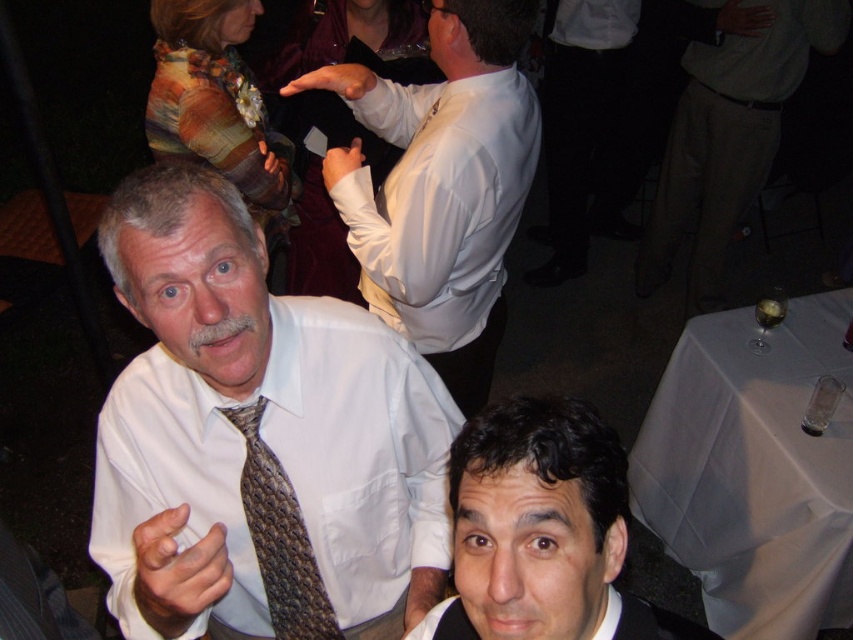
Between white satin shirt at upper center and textured brown tie at center, which one is positioned lower?

textured brown tie at center is below.

Between white satin shirt at upper center and textured brown tie at center, which one appears on the right side from the viewer's perspective?

Positioned to the right is white satin shirt at upper center.

Does point (404, 236) come farther from viewer compared to point (283, 512)?

Yes.

You are a GUI agent. You are given a task and a screenshot of the screen. Output one action in this format:
    pyautogui.click(x=<x>, y=<y>)
    Task: Click on the white satin shirt at upper center
    This screenshot has height=640, width=853.
    Given the screenshot: What is the action you would take?
    pyautogui.click(x=440, y=202)

Is point (167, 406) positioned in front of point (260, 492)?

Yes, it is in front of point (260, 492).

The width and height of the screenshot is (853, 640). Find the location of `white textured shirt at center`. white textured shirt at center is located at coordinates (x=283, y=464).

Between smooth black hair at lower right and textured brown tie at center, which one is positioned higher?

smooth black hair at lower right

Is point (473, 588) positioned in front of point (282, 589)?

Yes, point (473, 588) is in front of point (282, 589).

Measure the distance between smooth black hair at lower right and camera.

The distance of smooth black hair at lower right from camera is 64.76 centimeters.

Where is `smooth black hair at lower right`? smooth black hair at lower right is located at coordinates (543, 531).